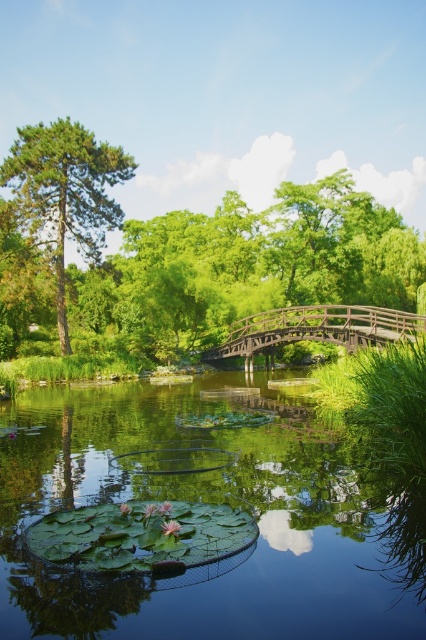
You are a bird flying over the pond and want to land on the highest point between the green textured pine tree at upper left and the wooden bridge at center. Which one should you choose?

The green textured pine tree at upper left is taller than the wooden bridge at center, so you should choose the green textured pine tree at upper left to land on the highest point.

You are standing on the wooden bridge and looking towards the green matte tree at left and the green textured pine tree at upper left. Which tree appears closer to you?

The green matte tree at left appears closer to you because the green textured pine tree at upper left is positioned behind it.

You are standing on the wooden bridge and want to reach the point labeled as point (92, 218). However, there is an obstacle at point (137, 246). Which point is closer to you so you can navigate around it?

Point (92, 218) is closer to you than point (137, 246), so you should navigate around the obstacle at point (137, 246) first.